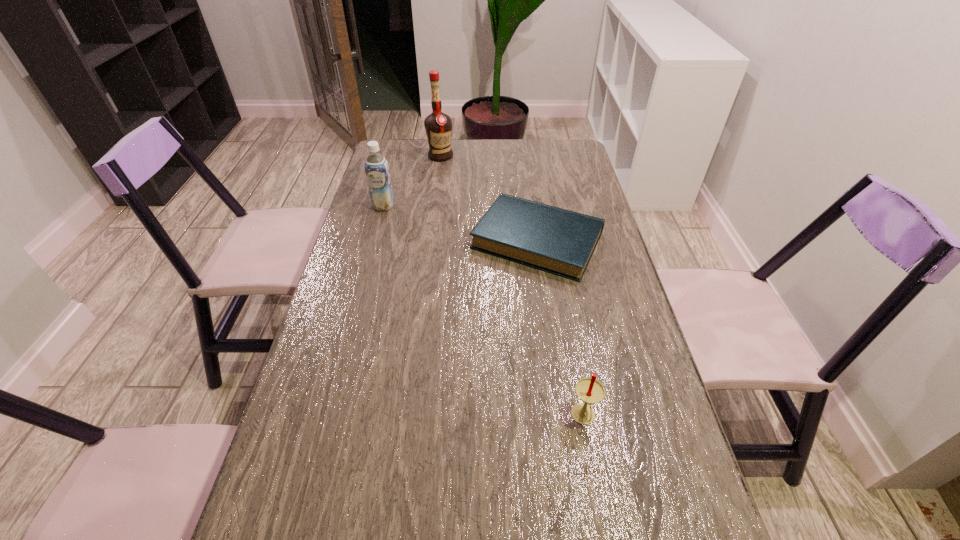
Locate an element on the screen. The image size is (960, 540). the third object from right to left is located at coordinates (438, 126).

Image resolution: width=960 pixels, height=540 pixels. Identify the location of liquor. (438, 126).

This screenshot has width=960, height=540. In order to click on soya milk in this screenshot , I will do `click(377, 172)`.

Identify the location of the third shortest object. This screenshot has width=960, height=540. (377, 172).

You are a GUI agent. You are given a task and a screenshot of the screen. Output one action in this format:
    pyautogui.click(x=<x>, y=<y>)
    Task: Click on the second shortest object
    The width and height of the screenshot is (960, 540).
    Given the screenshot: What is the action you would take?
    pyautogui.click(x=589, y=390)

Where is `candle`? Image resolution: width=960 pixels, height=540 pixels. candle is located at coordinates (589, 390).

Locate an element on the screen. This screenshot has height=540, width=960. the shortest object is located at coordinates [559, 241].

This screenshot has width=960, height=540. In order to click on vacant region located on the front and back of the tallest object in this screenshot , I will do `click(435, 195)`.

You are a GUI agent. You are given a task and a screenshot of the screen. Output one action in this format:
    pyautogui.click(x=<x>, y=<y>)
    Task: Click on the free spot located 0.360m on the label of the leftmost object
    
    Given the screenshot: What is the action you would take?
    pyautogui.click(x=361, y=290)

The width and height of the screenshot is (960, 540). I want to click on vacant region located 0.330m on the left of the third tallest object, so click(413, 417).